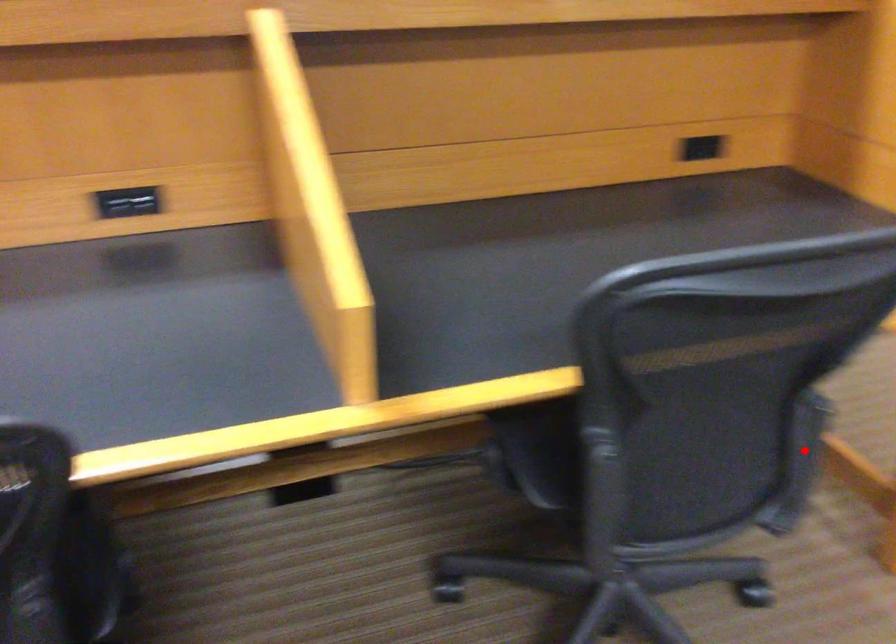
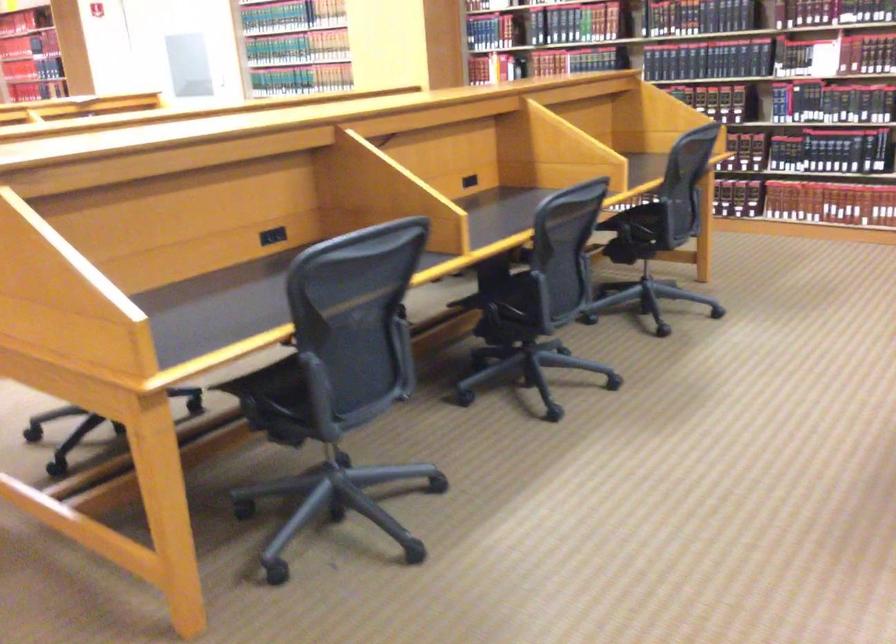
Question: I am providing you with two images of the same scene from different viewpoints. A red point is marked on the first image. Is the red point's position out of view in image 2?

Choices:
 (A) Yes
 (B) No

Answer: (A)